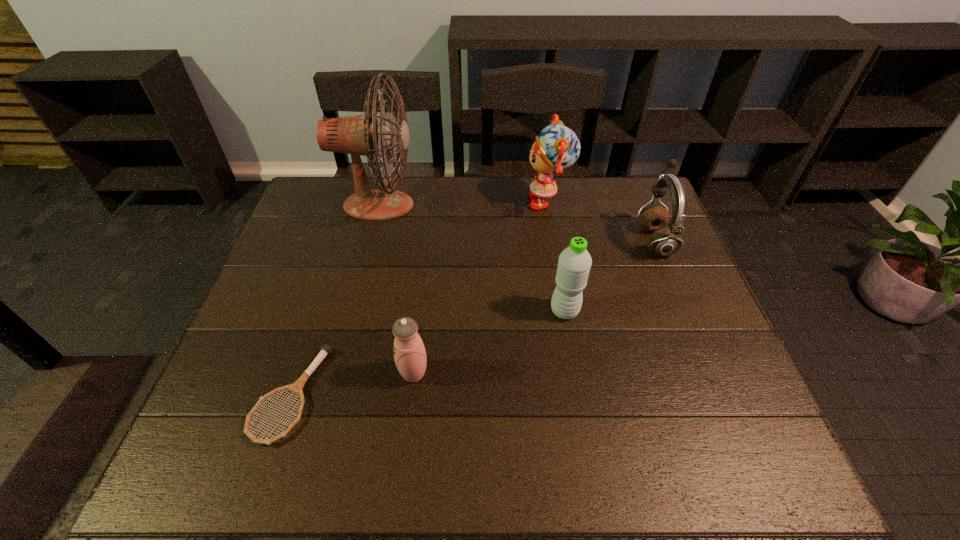
Where is `vacant position located 0.230m on the face of the doll`? This screenshot has height=540, width=960. vacant position located 0.230m on the face of the doll is located at coordinates click(x=454, y=202).

This screenshot has height=540, width=960. Identify the location of free space located on the ear pads of the rightmost object. pyautogui.click(x=584, y=240).

Where is `free region located 0.060m on the ear pads of the rightmost object`? The height and width of the screenshot is (540, 960). free region located 0.060m on the ear pads of the rightmost object is located at coordinates (618, 240).

At what (x,y) coordinates should I click in order to perform the action: click on vacant area located on the ear pads of the rightmost object. Please return your answer as a coordinate pair (x, y). This screenshot has height=540, width=960. Looking at the image, I should click on (525, 240).

You are a GUI agent. You are given a task and a screenshot of the screen. Output one action in this format:
    pyautogui.click(x=<x>, y=<y>)
    Task: Click on the free spot located on the back of the fourth farthest object
    The height and width of the screenshot is (540, 960).
    Given the screenshot: What is the action you would take?
    pyautogui.click(x=551, y=229)

In order to click on free space located 0.170m on the back of the fifth tallest object in this screenshot , I will do `click(422, 304)`.

The height and width of the screenshot is (540, 960). What are the coordinates of `free location located 0.230m on the back of the shortest object` in the screenshot? It's located at (329, 278).

Identify the location of fan that is at the far edge. The image size is (960, 540). (357, 135).

You are a GUI agent. You are given a task and a screenshot of the screen. Output one action in this format:
    pyautogui.click(x=<x>, y=<y>)
    Task: Click on the doll located in the far edge section of the desktop
    
    Given the screenshot: What is the action you would take?
    pyautogui.click(x=557, y=147)

You are a GUI agent. You are given a task and a screenshot of the screen. Output one action in this format:
    pyautogui.click(x=<x>, y=<y>)
    Task: Click on the earphone that is at the far edge
    
    Given the screenshot: What is the action you would take?
    pyautogui.click(x=663, y=242)